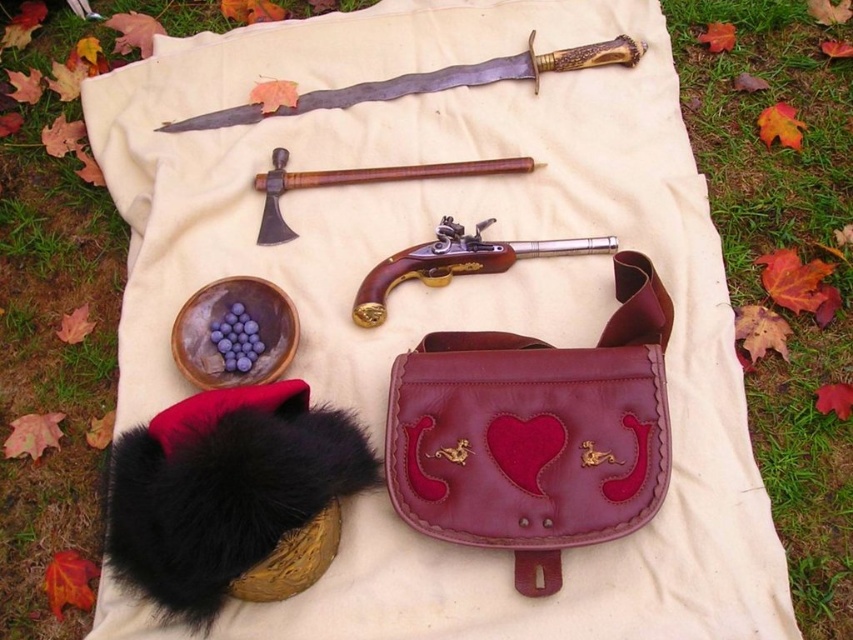
You are a person who wants to place a 10 inch long ruler between the green grass at upper left and the black fuzzy hat at lower left. Can you fit the ruler horizontally between them without overlapping either object?

The distance between the green grass at upper left and the black fuzzy hat at lower left is 11.61 inches. Since the ruler is 10 inches long, it can fit horizontally between them without overlapping either object.

Looking at this image, you are a historical reenactor who needs to grab your hat and pistol quickly. The hat is the black fuzzy hat at lower left and the pistol is the polished brass flintlock pistol at upper center. If you are standing at the center of the cloth, which item would you reach first considering their positions?

The black fuzzy hat at lower left is closer to your current position at the center of the cloth than the polished brass flintlock pistol at upper center, so you would reach the black fuzzy hat at lower left first.